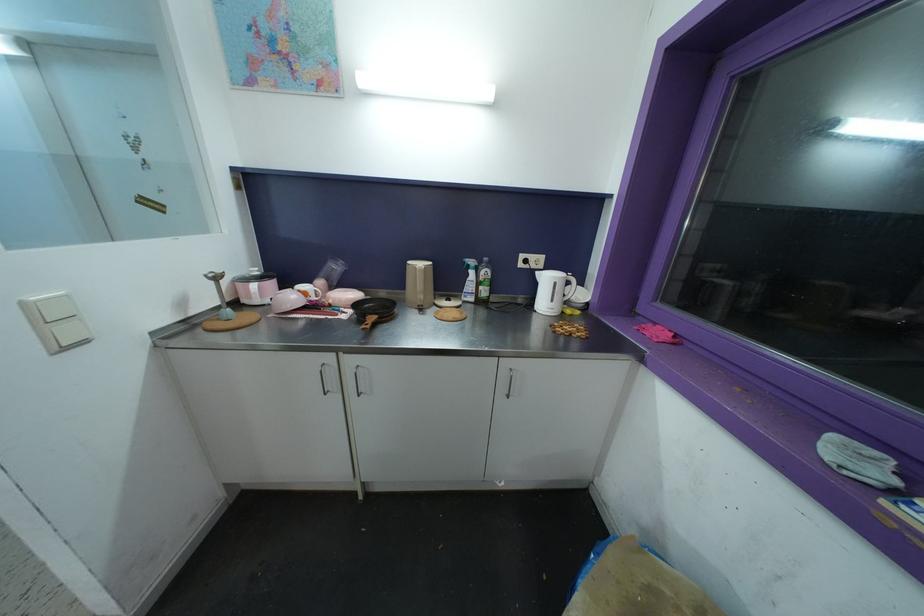
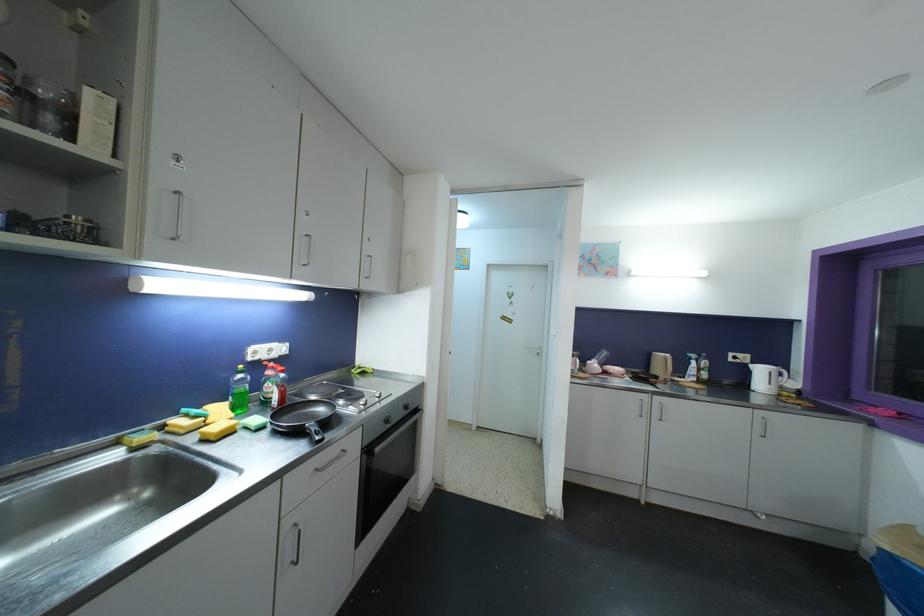
Question: I am providing you with two images of the same scene from different viewpoints. After the viewpoint changes to image2, which objects are now occluded?

Choices:
 (A) frying pan handle
 (B) kettle handle
 (C) blue trash bag
 (D) none of these

Answer: (D)